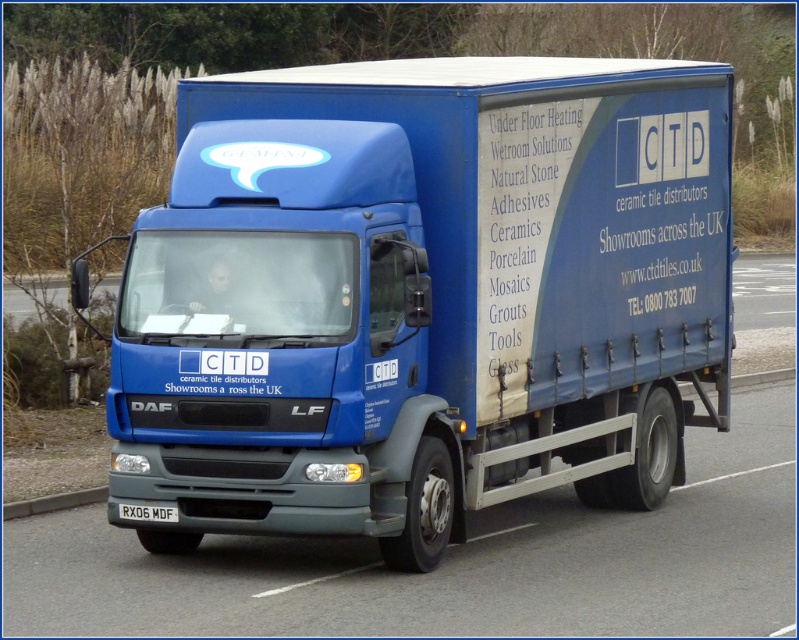
You are a photographer trying to capture the matte blue truck at center and the white plastic license plate at bottom in a single frame. Given that the truck is narrower than the license plate, will the truck occupy more or less space in the photo compared to the license plate?

The matte blue truck at center is narrower than the white plastic license plate at bottom, so it will occupy less space in the photo compared to the license plate.

You are a pedestrian standing at the point closest to the truck. Which point, point (x=579, y=272) or point (x=142, y=506), is closer to you?

Point (x=142, y=506) is closer to you because it is in front of point (x=579, y=272).